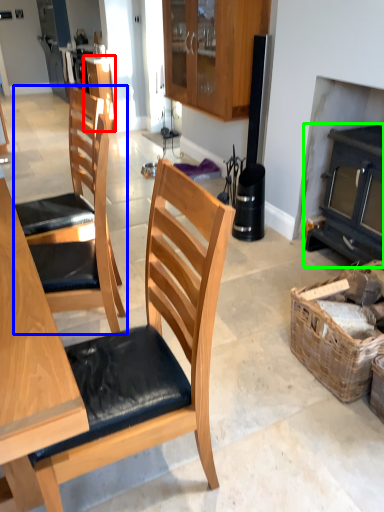
Question: Based on their relative distances, which object is nearer to cabinetry (highlighted by a red box)? Choose from chair (highlighted by a blue box) and fireplace (highlighted by a green box).

Choices:
 (A) chair
 (B) fireplace

Answer: (A)